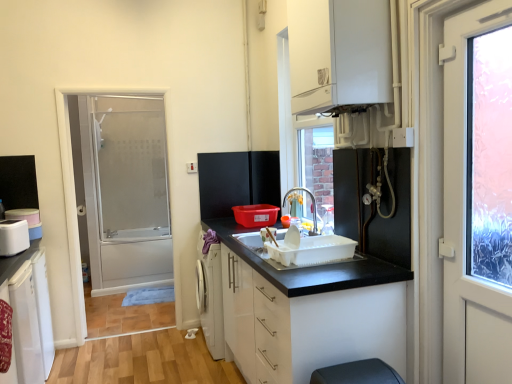
Question: Does white matte cabinet at center, which is counted as the second cabinetry, starting from the bottom, have a greater width compared to white glossy cabinet at upper center, marked as the 3th cabinetry in a bottom-to-top arrangement?

Choices:
 (A) yes
 (B) no

Answer: (A)

Question: Considering the relative positions of white matte cabinet at center, the 2th cabinetry when ordered from top to bottom, and white glossy cabinet at upper center, which is the third cabinetry from left to right, in the image provided, is white matte cabinet at center, the 2th cabinetry when ordered from top to bottom, in front of white glossy cabinet at upper center, which is the third cabinetry from left to right,?

Choices:
 (A) no
 (B) yes

Answer: (B)

Question: Considering the relative positions of white matte cabinet at center, the 2th cabinetry when ordered from top to bottom, and white glossy cabinet at upper center, which is the third cabinetry from left to right, in the image provided, is white matte cabinet at center, the 2th cabinetry when ordered from top to bottom, behind white glossy cabinet at upper center, which is the third cabinetry from left to right,?

Choices:
 (A) yes
 (B) no

Answer: (B)

Question: Can white glossy cabinet at upper center, which is the third cabinetry from left to right, be found inside white matte cabinet at center, which is the 2th cabinetry from left to right?

Choices:
 (A) yes
 (B) no

Answer: (B)

Question: Is white matte cabinet at center, the 2th cabinetry when ordered from top to bottom, oriented away from white glossy cabinet at upper center, which is the third cabinetry from left to right?

Choices:
 (A) yes
 (B) no

Answer: (B)

Question: Can you confirm if white matte cabinet at center, which is the 2th cabinetry from left to right, is positioned to the right of white glossy cabinet at upper center, the first cabinetry viewed from the right?

Choices:
 (A) no
 (B) yes

Answer: (A)

Question: Is white matte cabinet at center, the 2th cabinetry when ordered from top to bottom, positioned behind frosted glass shower door at left?

Choices:
 (A) yes
 (B) no

Answer: (B)

Question: Is white matte cabinet at center, which is the 2th cabinetry from left to right, taller than frosted glass shower door at left?

Choices:
 (A) yes
 (B) no

Answer: (B)

Question: From a real-world perspective, is white matte cabinet at center, which is counted as the second cabinetry, starting from the bottom, below frosted glass shower door at left?

Choices:
 (A) no
 (B) yes

Answer: (B)

Question: From a real-world perspective, does white matte cabinet at center, which is counted as the second cabinetry, starting from the bottom, stand above frosted glass shower door at left?

Choices:
 (A) no
 (B) yes

Answer: (A)

Question: Does white matte cabinet at center, positioned as the second cabinetry in right-to-left order, have a smaller size compared to frosted glass shower door at left?

Choices:
 (A) yes
 (B) no

Answer: (B)

Question: From the image's perspective, is white matte cabinet at center, which is the 2th cabinetry from left to right, beneath frosted glass shower door at left?

Choices:
 (A) yes
 (B) no

Answer: (A)

Question: Does white glossy cabinet at upper center, the first cabinetry viewed from the top, have a larger size compared to black matte refrigerator at center, which appears as the 2th appliance when ordered from the bottom?

Choices:
 (A) yes
 (B) no

Answer: (A)